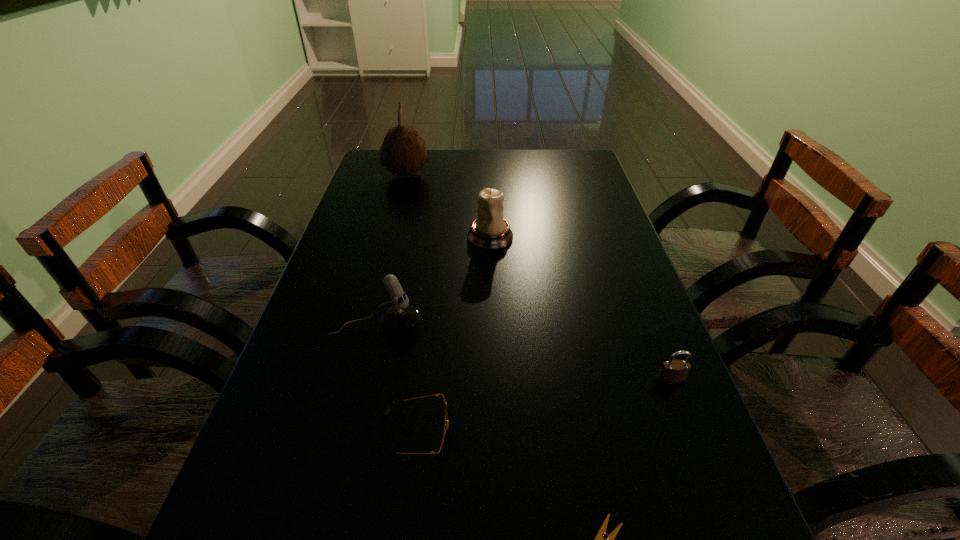
Select which object appears as the third closest to the tallest object. Please provide its 2D coordinates. Your answer should be formatted as a tuple, i.e. [(x, y)], where the tuple contains the x and y coordinates of a point satisfying the conditions above.

[(445, 432)]

Where is `the fourth closest object to the microphone`? The height and width of the screenshot is (540, 960). the fourth closest object to the microphone is located at coordinates (673, 372).

Locate an element on the screen. The width and height of the screenshot is (960, 540). vacant area that satisfies the following two spatial constraints: 1. on the front side of the padlock; 2. on the right side of the fifth nearest object is located at coordinates (494, 381).